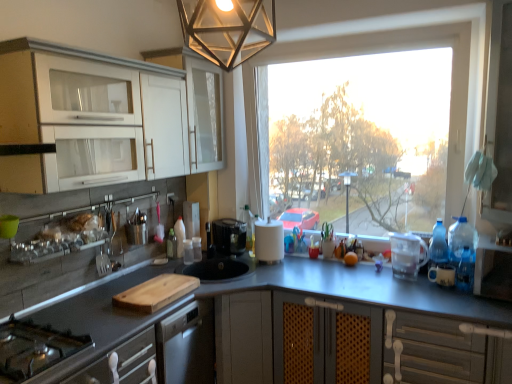
Question: Does metallic geometric light fixture at upper center touch white glossy cabinet at upper left, which is the 2th cabinetry from back to front?

Choices:
 (A) no
 (B) yes

Answer: (A)

Question: From the image's perspective, would you say metallic geometric light fixture at upper center is positioned over white glossy cabinet at upper left, which is the 2th cabinetry from back to front?

Choices:
 (A) yes
 (B) no

Answer: (A)

Question: Can you confirm if metallic geometric light fixture at upper center is shorter than white glossy cabinet at upper left, which is the 2th cabinetry from back to front?

Choices:
 (A) no
 (B) yes

Answer: (B)

Question: Is white glossy cabinet at upper left, which is counted as the first cabinetry, starting from the front, a part of metallic geometric light fixture at upper center?

Choices:
 (A) no
 (B) yes

Answer: (A)

Question: Is metallic geometric light fixture at upper center far away from white glossy cabinet at upper left, which is the 2th cabinetry from back to front?

Choices:
 (A) no
 (B) yes

Answer: (A)

Question: From the image's perspective, does metallic geometric light fixture at upper center appear lower than white glossy cabinet at upper left, which is counted as the first cabinetry, starting from the front?

Choices:
 (A) no
 (B) yes

Answer: (A)

Question: Does white plastic screen door at right lie behind orange matte at counter?

Choices:
 (A) no
 (B) yes

Answer: (A)

Question: Does white plastic screen door at right appear on the left side of orange matte at counter?

Choices:
 (A) yes
 (B) no

Answer: (B)

Question: Considering the relative sizes of white plastic screen door at right and orange matte at counter in the image provided, is white plastic screen door at right wider than orange matte at counter?

Choices:
 (A) yes
 (B) no

Answer: (A)

Question: Does white plastic screen door at right have a lesser width compared to orange matte at counter?

Choices:
 (A) no
 (B) yes

Answer: (A)

Question: Is white plastic screen door at right located outside orange matte at counter?

Choices:
 (A) no
 (B) yes

Answer: (B)

Question: Is white plastic screen door at right taller than orange matte at counter?

Choices:
 (A) yes
 (B) no

Answer: (A)

Question: Is translucent plastic bottle at center, the 3th bottle when ordered from right to left, shorter than transparent glass window at center?

Choices:
 (A) yes
 (B) no

Answer: (A)